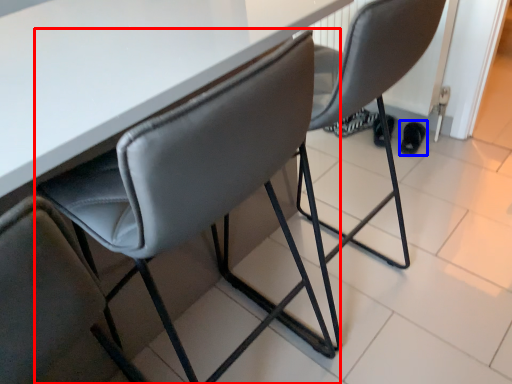
Question: Which object is closer to the camera taking this photo, chair (highlighted by a red box) or footwear (highlighted by a blue box)?

Choices:
 (A) chair
 (B) footwear

Answer: (A)